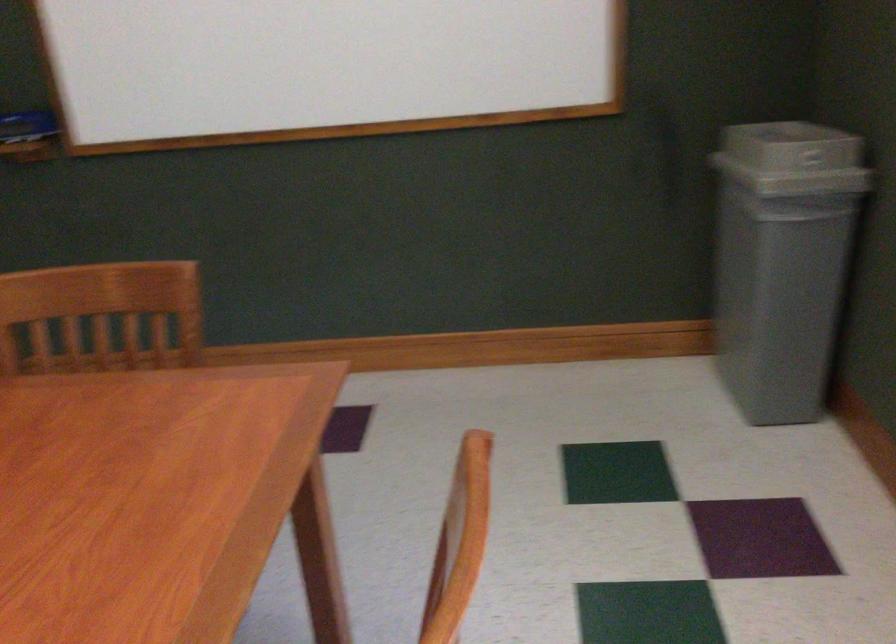
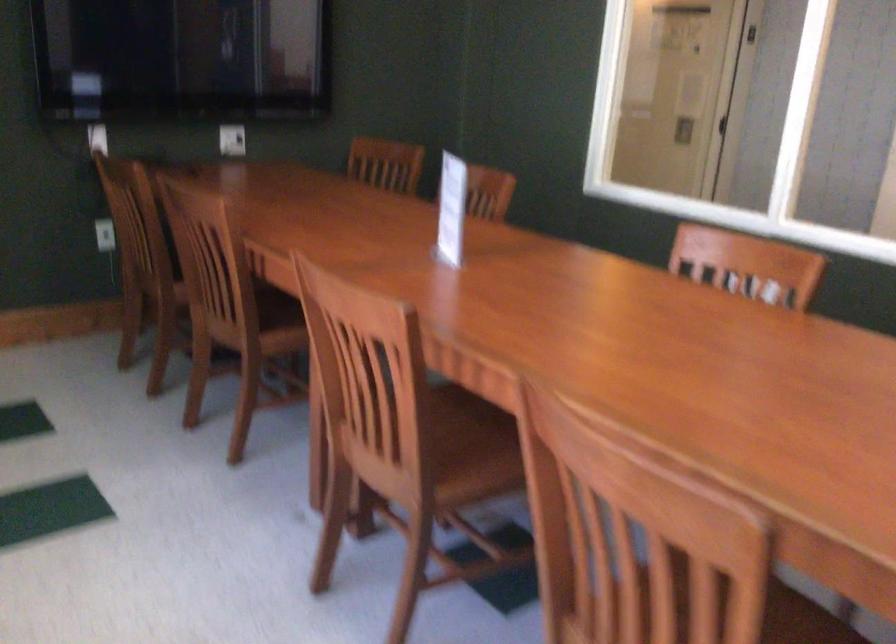
Find the pixel in the second image that matches point (467, 542) in the first image.

(709, 588)